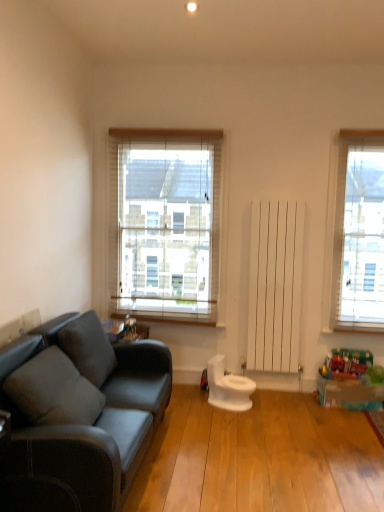
Question: Does metallic silver toy at center, which is the first toy in top-to-bottom order, have a smaller size compared to soft gray cushion at left, acting as the 1th pillow starting from the front?

Choices:
 (A) yes
 (B) no

Answer: (A)

Question: From the image's perspective, is metallic silver toy at center, the 2th toy positioned from the bottom, below soft gray cushion at left, which ranks as the 2th pillow in back-to-front order?

Choices:
 (A) no
 (B) yes

Answer: (A)

Question: Does metallic silver toy at center, which is the first toy in top-to-bottom order, appear on the right side of soft gray cushion at left, which ranks as the 2th pillow in back-to-front order?

Choices:
 (A) yes
 (B) no

Answer: (A)

Question: Is metallic silver toy at center, which is the first toy in top-to-bottom order, at the left side of soft gray cushion at left, acting as the 1th pillow starting from the front?

Choices:
 (A) yes
 (B) no

Answer: (B)

Question: Can you confirm if metallic silver toy at center, which is the second toy from right to left, is thinner than soft gray cushion at left, which ranks as the 2th pillow in back-to-front order?

Choices:
 (A) yes
 (B) no

Answer: (A)

Question: Considering the relative sizes of metallic silver toy at center, which is the first toy in top-to-bottom order, and soft gray cushion at left, acting as the 1th pillow starting from the front, in the image provided, is metallic silver toy at center, which is the first toy in top-to-bottom order, taller than soft gray cushion at left, acting as the 1th pillow starting from the front,?

Choices:
 (A) no
 (B) yes

Answer: (A)

Question: Considering the relative sizes of white glossy toilet at center and metallic silver toy at center, which is the second toy from right to left, in the image provided, is white glossy toilet at center taller than metallic silver toy at center, which is the second toy from right to left,?

Choices:
 (A) yes
 (B) no

Answer: (A)

Question: Is metallic silver toy at center, the first toy in the left-to-right sequence, located within white glossy toilet at center?

Choices:
 (A) no
 (B) yes

Answer: (A)

Question: From a real-world perspective, is white glossy toilet at center beneath metallic silver toy at center, which is the first toy in top-to-bottom order?

Choices:
 (A) no
 (B) yes

Answer: (B)

Question: Is the depth of white glossy toilet at center greater than that of metallic silver toy at center, which is the second toy from right to left?

Choices:
 (A) yes
 (B) no

Answer: (B)

Question: Can you confirm if white glossy toilet at center is positioned to the right of metallic silver toy at center, which is the first toy in top-to-bottom order?

Choices:
 (A) no
 (B) yes

Answer: (B)

Question: Can you confirm if white glossy toilet at center is wider than metallic silver toy at center, the 2th toy positioned from the bottom?

Choices:
 (A) yes
 (B) no

Answer: (A)

Question: From a real-world perspective, is metallic silver toy at center, the 2th toy positioned from the bottom, physically below white wood blinds at center?

Choices:
 (A) no
 (B) yes

Answer: (B)